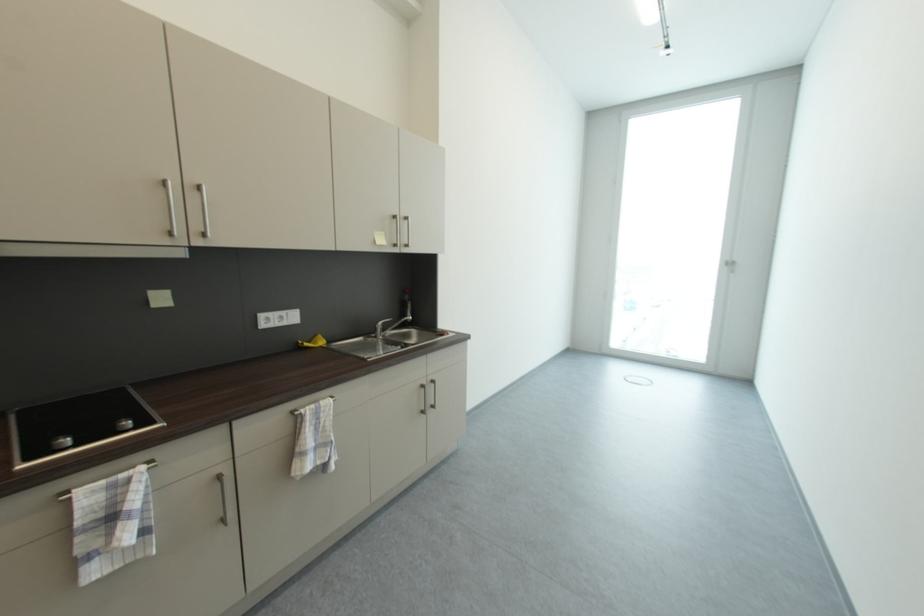
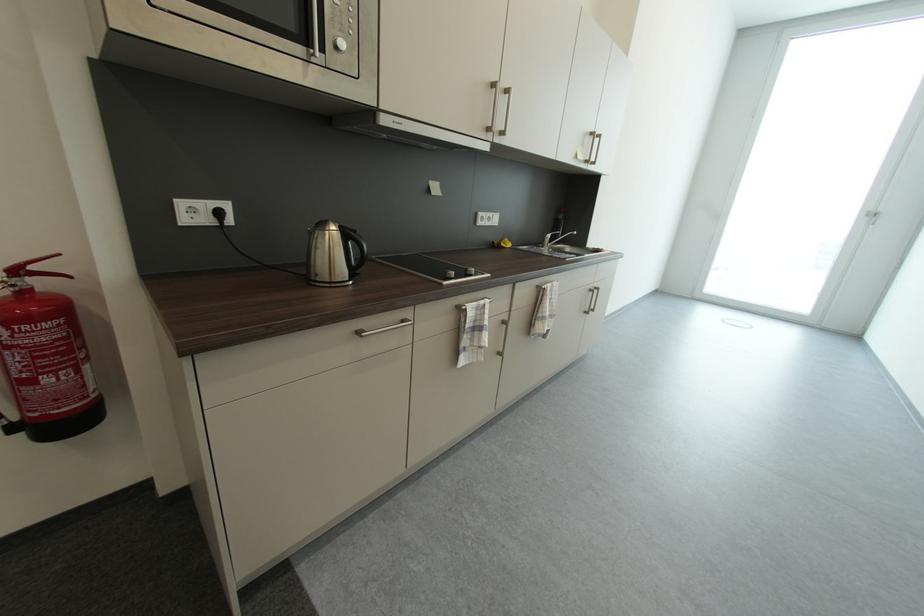
Find the pixel in the second image that matches (x=305, y=344) in the first image.

(501, 244)